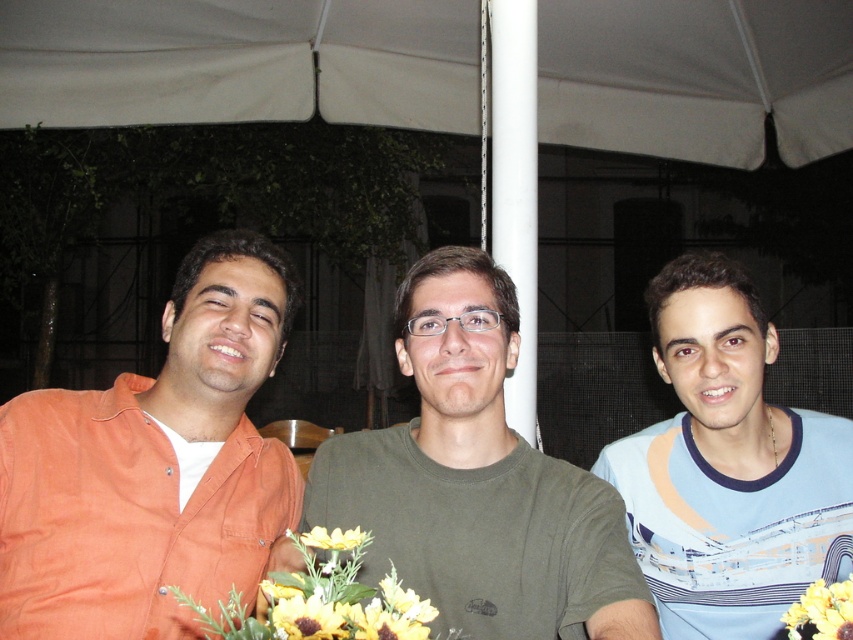
Is orange cotton shirt at left below yellow matte flower at center?

Incorrect, orange cotton shirt at left is not positioned below yellow matte flower at center.

Is orange cotton shirt at left shorter than yellow matte flower at center?

In fact, orange cotton shirt at left may be taller than yellow matte flower at center.

Is point (196, 403) positioned after point (827, 586)?

No.

At what (x,y) coordinates should I click in order to perform the action: click on orange cotton shirt at left. Please return your answer as a coordinate pair (x, y). The height and width of the screenshot is (640, 853). Looking at the image, I should click on (152, 467).

Is blue printed t-shirt at center to the right of yellow matte flower at center from the viewer's perspective?

Yes, blue printed t-shirt at center is to the right of yellow matte flower at center.

Does blue printed t-shirt at center appear under yellow matte flower at center?

No.

Image resolution: width=853 pixels, height=640 pixels. Describe the element at coordinates (728, 467) in the screenshot. I see `blue printed t-shirt at center` at that location.

At what (x,y) coordinates should I click in order to perform the action: click on blue printed t-shirt at center. Please return your answer as a coordinate pair (x, y). This screenshot has height=640, width=853. Looking at the image, I should click on (728, 467).

Between green matte t-shirt at center and yellow artificial flowers at center, which one has more height?

Standing taller between the two is green matte t-shirt at center.

Based on the photo, is green matte t-shirt at center further to camera compared to yellow artificial flowers at center?

That is True.

Between point (485, 348) and point (376, 637), which one is positioned in front?

Point (376, 637)

Locate an element on the screen. green matte t-shirt at center is located at coordinates (479, 481).